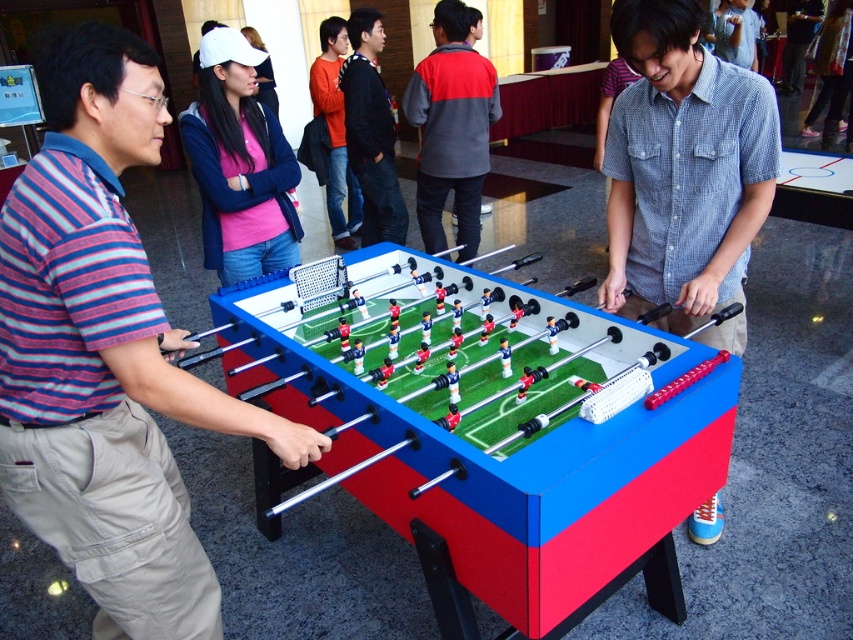
Question: Is gray/red fleece jacket at center positioned before orange shirt at center?

Choices:
 (A) no
 (B) yes

Answer: (B)

Question: Which of these objects is positioned closest to the gray/red fleece jacket at center?

Choices:
 (A) blue plastic foosball table at center
 (B) blue checkered shirt at center
 (C) dark blue jeans at center
 (D) matte pink shirt at upper center

Answer: (C)

Question: Can you confirm if blue plastic foosball table at center is thinner than gray/red fleece jacket at center?

Choices:
 (A) no
 (B) yes

Answer: (A)

Question: Can you confirm if matte pink shirt at upper center is thinner than orange shirt at center?

Choices:
 (A) yes
 (B) no

Answer: (B)

Question: Which point is farther to the camera?

Choices:
 (A) blue plastic foosball table at center
 (B) blue checkered shirt at center

Answer: (B)

Question: Which object is farther from the camera taking this photo?

Choices:
 (A) blue checkered shirt at center
 (B) orange shirt at center

Answer: (B)